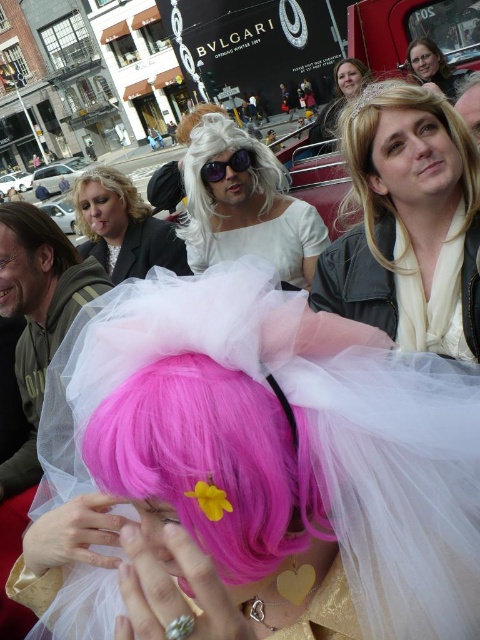
Question: Which point is closer to the camera?

Choices:
 (A) pink tulle wig at center
 (B) pink tulle dress at center
 (C) blonde hair at upper center
 (D) pink tulle wig at lower center

Answer: (B)

Question: Can you confirm if blondehair at upper left is positioned to the right of brown straight hair at upper left?

Choices:
 (A) yes
 (B) no

Answer: (A)

Question: Observing the image, what is the correct spatial positioning of matte black suit at upper left in reference to matte white tulle at upper center?

Choices:
 (A) below
 (B) above

Answer: (A)

Question: Among these objects, which one is farthest from the camera?

Choices:
 (A) pink tulle wig at center
 (B) pink tulle dress at center

Answer: (A)

Question: Which point is farther to the camera?

Choices:
 (A) (100, 182)
 (B) (19, 204)

Answer: (A)

Question: Can you confirm if pink tulle wig at lower center is positioned below blondehair at upper left?

Choices:
 (A) no
 (B) yes

Answer: (B)